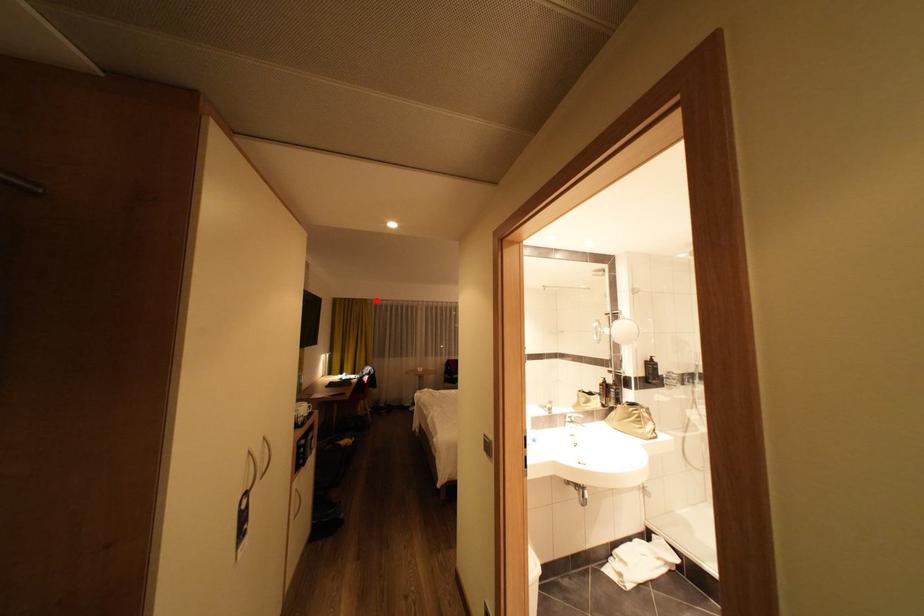
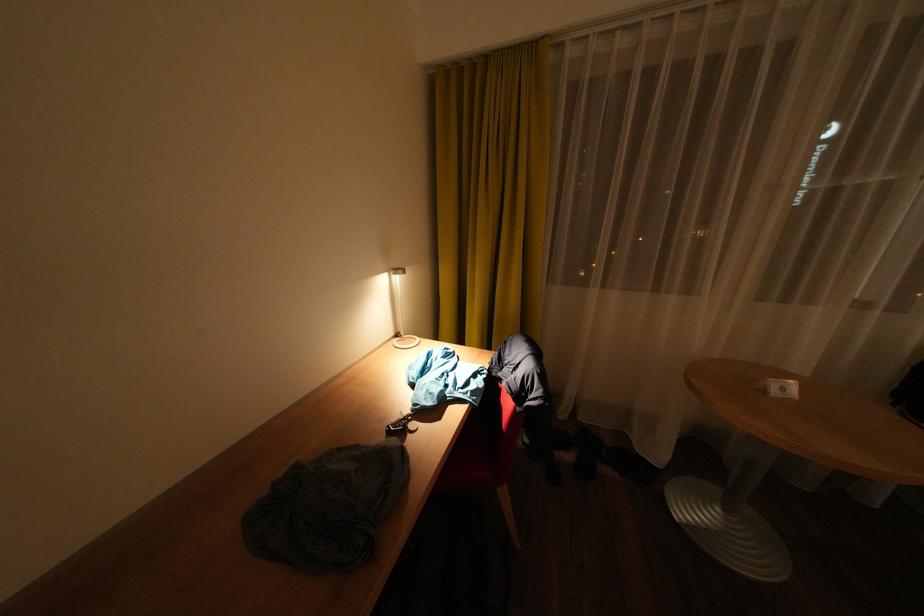
Question: I am providing you with two images of the same scene from different viewpoints. A red point is marked on the first image. At the location where the point appears in image 1, is it still visible in image 2?

Choices:
 (A) Yes
 (B) No

Answer: (A)